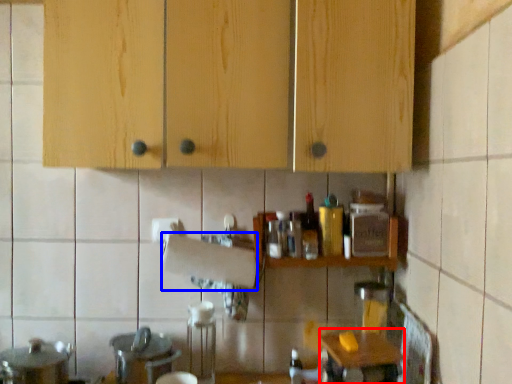
Question: Among these objects, which one is nearest to the camera, table (highlighted by a red box) or paper towel (highlighted by a blue box)?

Choices:
 (A) table
 (B) paper towel

Answer: (A)